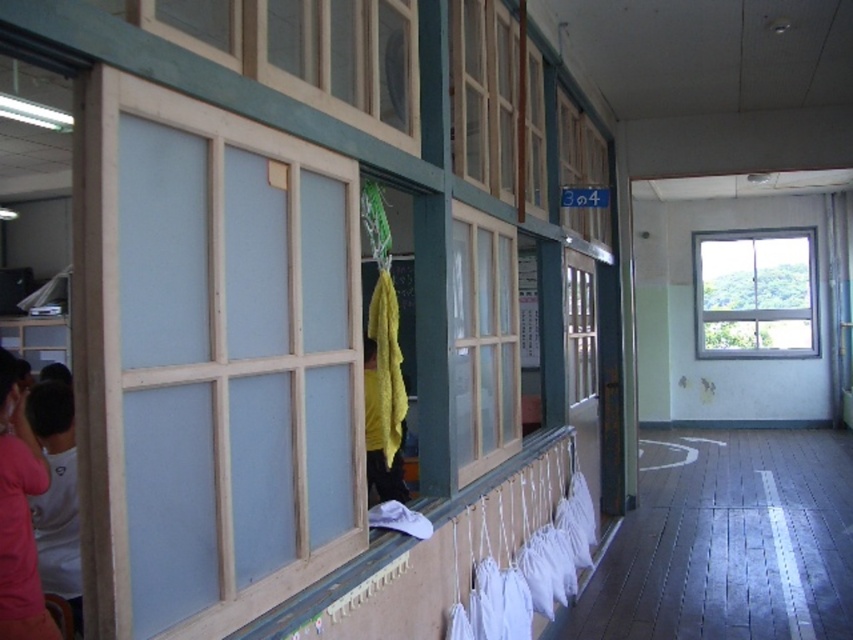
You are standing in the classroom and notice two windows at the center. The light blue wood window at center and the wooden frame window at center. Which one is positioned lower?

The light blue wood window at center is located below the wooden frame window at center, so it is positioned lower.

You are standing in the classroom and want to see outside through the clear glass window at center. However, there is a yellow fabric at center hanging in front of it. Can you see through the window? Explain why or why not based on their heights.

The clear glass window at center has a lesser height compared to the yellow fabric at center. This means the yellow fabric at center extends lower than the window, potentially blocking the lower portion of the window. Therefore, you might not be able to see through the entire window as the yellow fabric at center may obstruct your view.

You are standing in the classroom and want to check the width of the light blue wood window at center and the pink fabric at lower left. Which one is narrower?

The light blue wood window at center is narrower than the pink fabric at lower left because it has a lesser width compared to it.